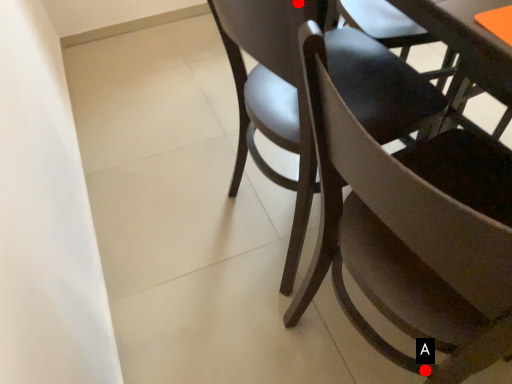
Question: Two points are circled on the image, labeled by A and B beside each circle. Among these points, which one is nearest to the camera?

Choices:
 (A) A is closer
 (B) B is closer

Answer: (B)